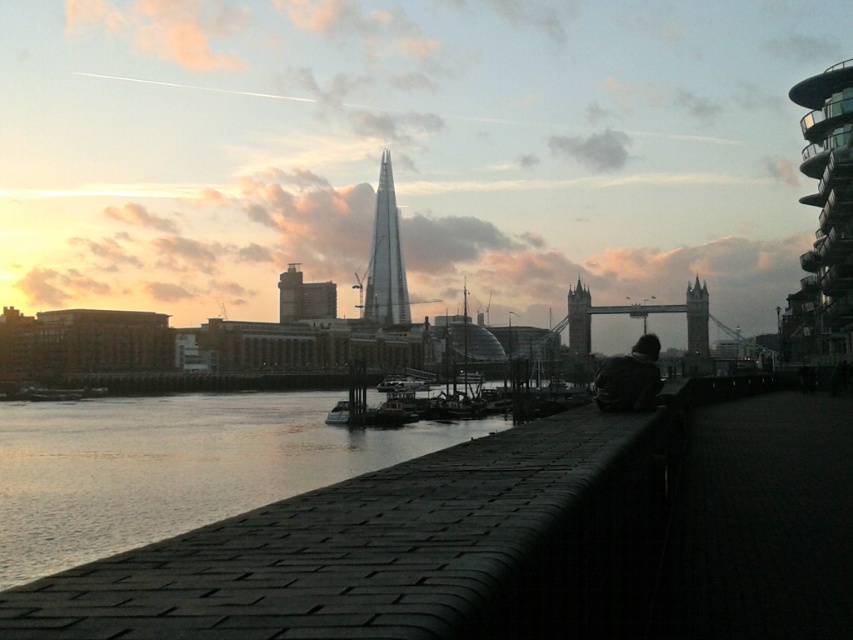
How far apart are stone gray tower at center and stone tower at center?

stone gray tower at center is 33.15 meters from stone tower at center.

Does stone gray tower at center appear over stone tower at center?

Yes.

Does point (705, 323) come in front of point (572, 332)?

No, (705, 323) is further to viewer.

This screenshot has height=640, width=853. Find the location of `stone gray tower at center`. stone gray tower at center is located at coordinates (697, 323).

Can you confirm if smooth concrete river at lower left is positioned above stone tower at center?

No, smooth concrete river at lower left is not above stone tower at center.

Who is more distant from viewer, (x=219, y=502) or (x=577, y=291)?

Point (x=577, y=291)

What do you see at coordinates (173, 467) in the screenshot? I see `smooth concrete river at lower left` at bounding box center [173, 467].

Locate an element on the screen. Image resolution: width=853 pixels, height=640 pixels. smooth concrete river at lower left is located at coordinates (173, 467).

Can you confirm if smooth concrete river at lower left is positioned to the right of red brick building at center?

Indeed, smooth concrete river at lower left is positioned on the right side of red brick building at center.

Who is positioned more to the right, smooth concrete river at lower left or red brick building at center?

Positioned to the right is smooth concrete river at lower left.

The image size is (853, 640). What do you see at coordinates (173, 467) in the screenshot? I see `smooth concrete river at lower left` at bounding box center [173, 467].

This screenshot has width=853, height=640. In order to click on smooth concrete river at lower left in this screenshot , I will do `click(173, 467)`.